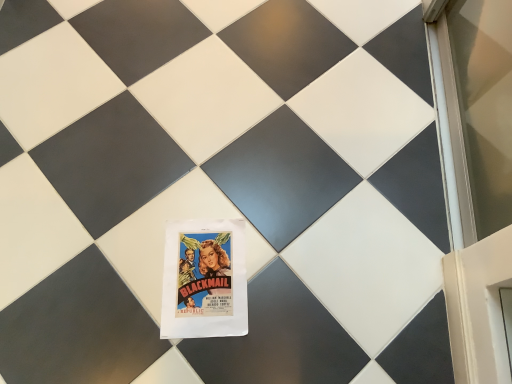
I want to click on free space to the left of matte paper poster at center, so click(128, 277).